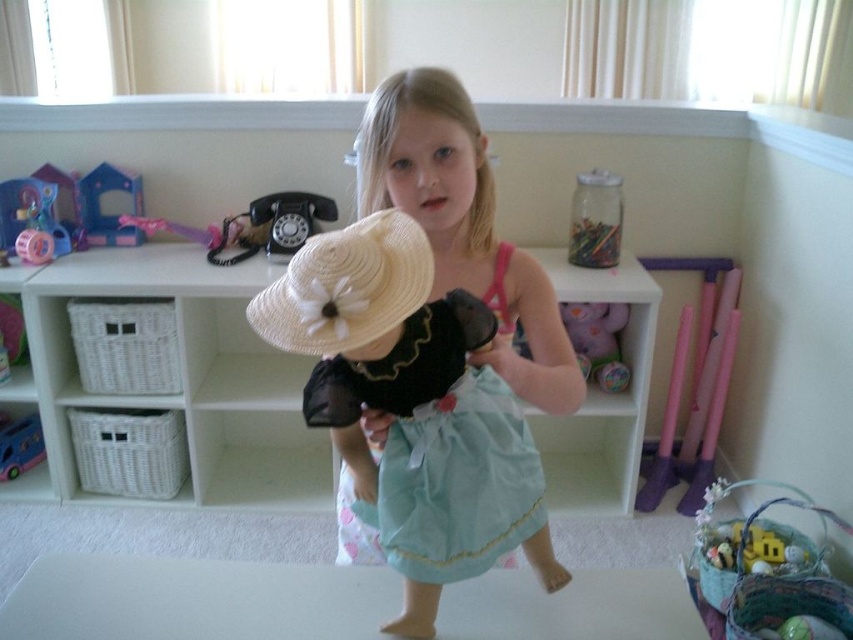
Question: Is the position of black plastic rotary phone at upper center more distant than that of light blue satin dress at center?

Choices:
 (A) no
 (B) yes

Answer: (B)

Question: Among these objects, which one is farthest from the camera?

Choices:
 (A) white wicker basket at center
 (B) matte purple plush at center
 (C) matte straw hat at center
 (D) metallic blue toy car at center

Answer: (D)

Question: Which of the following is the farthest from the observer?

Choices:
 (A) black plastic rotary phone at upper center
 (B) matte purple plush at center
 (C) yellow matte plush toy at lower right
 (D) wooden house at left

Answer: (D)

Question: Is black plastic rotary phone at upper center to the left of yellow matte plush toy at lower right from the viewer's perspective?

Choices:
 (A) yes
 (B) no

Answer: (A)

Question: From the image, what is the correct spatial relationship of wooden house at left in relation to metallic blue toy car at center?

Choices:
 (A) above
 (B) below

Answer: (A)

Question: Among these objects, which one is farthest from the camera?

Choices:
 (A) white wicker basket at center
 (B) matte plastic toy at left
 (C) matte straw hat at center
 (D) matte purple plush at center

Answer: (D)